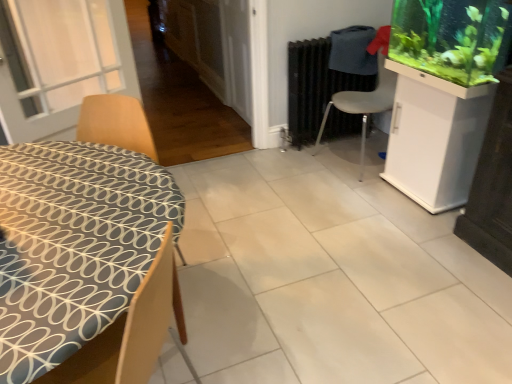
At what (x,y) coordinates should I click in order to perform the action: click on vacant space situated on the left part of white plastic chair at center-right, the first chair viewed from the right. Please return your answer as a coordinate pair (x, y). Looking at the image, I should click on (302, 163).